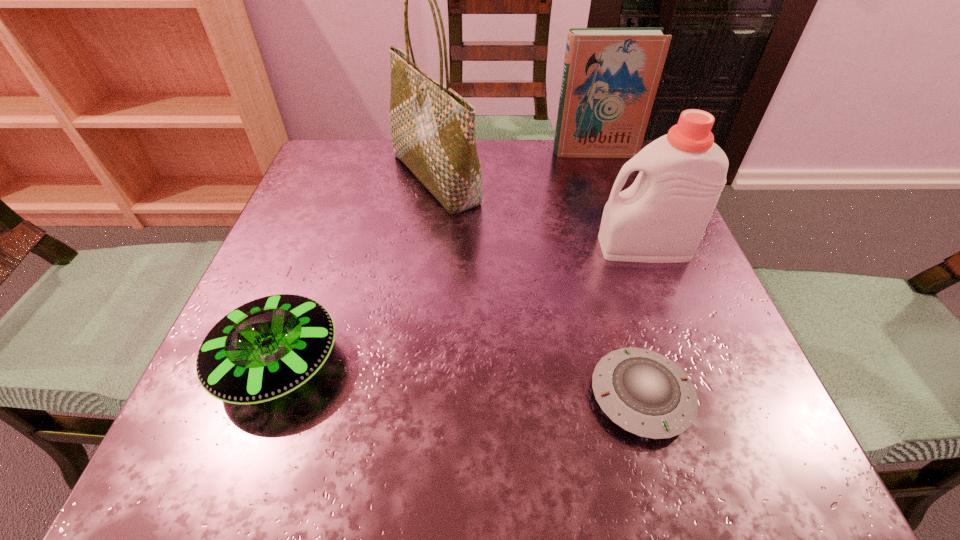
The width and height of the screenshot is (960, 540). What are the coordinates of `vacant space located on the handle side of the third nearest object` in the screenshot? It's located at (410, 247).

At what (x,y) coordinates should I click in order to perform the action: click on free space located on the handle side of the third nearest object. Please return your answer as a coordinate pair (x, y). This screenshot has height=540, width=960. Looking at the image, I should click on (504, 247).

At what (x,y) coordinates should I click in order to perform the action: click on vacant space located 0.360m on the handle side of the third nearest object. Please return your answer as a coordinate pair (x, y). The image size is (960, 540). Looking at the image, I should click on (398, 247).

You are a GUI agent. You are given a task and a screenshot of the screen. Output one action in this format:
    pyautogui.click(x=<x>, y=<y>)
    Task: Click on the vacant space situated 0.130m on the back of the left saucer
    
    Given the screenshot: What is the action you would take?
    pyautogui.click(x=318, y=257)

This screenshot has width=960, height=540. I want to click on blank area located on the back of the shorter saucer, so click(x=606, y=271).

Locate an element on the screen. This screenshot has width=960, height=540. shopping bag present at the far edge is located at coordinates (432, 127).

Where is `hardback book that is at the far edge`? hardback book that is at the far edge is located at coordinates tap(610, 77).

The image size is (960, 540). Identify the location of object that is positioned at the left edge. (265, 349).

Locate an element on the screen. The image size is (960, 540). hardback book that is at the right edge is located at coordinates (610, 77).

Identify the location of detergent located at the right edge. (661, 218).